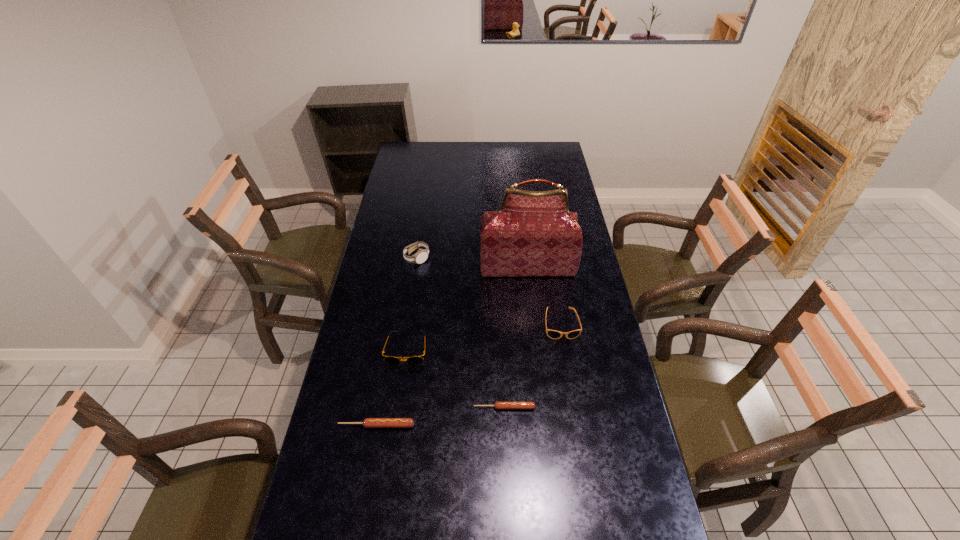
In the image, there is a desktop. Identify the location of vacant area at the left edge. (390, 280).

Locate an element on the screen. The image size is (960, 540). vacant position at the right edge of the desktop is located at coordinates (591, 301).

Image resolution: width=960 pixels, height=540 pixels. I want to click on free space at the far right corner of the desktop, so click(557, 143).

Find the location of a particular element. This screenshot has width=960, height=540. free point between the right sunglasses and the fifth shortest object is located at coordinates (489, 291).

You are a GUI agent. You are given a task and a screenshot of the screen. Output one action in this format:
    pyautogui.click(x=<x>, y=<y>)
    Task: Click on the free space between the watch and the shortest object
    
    Given the screenshot: What is the action you would take?
    pyautogui.click(x=461, y=333)

The width and height of the screenshot is (960, 540). What are the coordinates of `empty location between the left sausage and the left sunglasses` in the screenshot? It's located at (392, 387).

Find the location of a particular element. vacant point located between the fifth shortest object and the left sunglasses is located at coordinates (412, 303).

At what (x,y) coordinates should I click in order to perform the action: click on free space that is in between the left sunglasses and the right sausage. Please return your answer as a coordinate pair (x, y). The width and height of the screenshot is (960, 540). Looking at the image, I should click on (456, 378).

This screenshot has height=540, width=960. Find the location of `vacant space that is in between the left sunglasses and the shorter sausage`. vacant space that is in between the left sunglasses and the shorter sausage is located at coordinates (456, 378).

Locate an element on the screen. Image resolution: width=960 pixels, height=540 pixels. unoccupied area between the tallest object and the farther sausage is located at coordinates (516, 338).